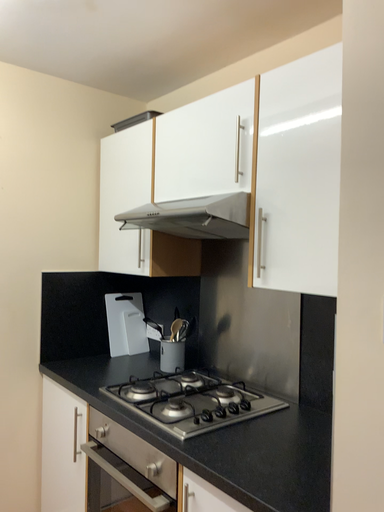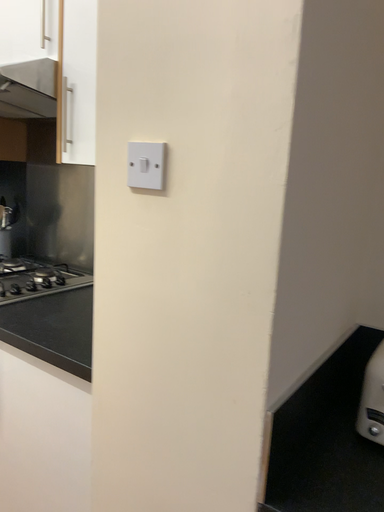
Question: How did the camera likely rotate when shooting the video?

Choices:
 (A) rotated left
 (B) rotated right

Answer: (B)